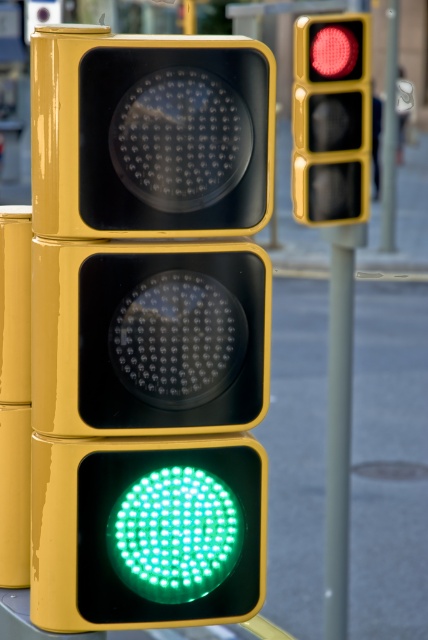
Question: Which object is the closest to the metallic gray pole at right?

Choices:
 (A) glossy yellow traffic light at center
 (B) matte red traffic light at upper right

Answer: (B)

Question: Which point is closer to the camera?

Choices:
 (A) (142, 612)
 (B) (341, 164)

Answer: (A)

Question: Can you confirm if matte yellow traffic light at upper center is smaller than matte red traffic light at upper right?

Choices:
 (A) yes
 (B) no

Answer: (A)

Question: Can you confirm if glossy yellow traffic light at center is positioned to the left of green led at bottom?

Choices:
 (A) yes
 (B) no

Answer: (A)

Question: Which point is closer to the camera?

Choices:
 (A) glossy yellow traffic light at center
 (B) matte yellow traffic light at upper center
 (C) green led at bottom
 (D) metallic pole at upper right

Answer: (B)

Question: Is matte yellow traffic light at upper center to the right of green led at bottom from the viewer's perspective?

Choices:
 (A) yes
 (B) no

Answer: (B)